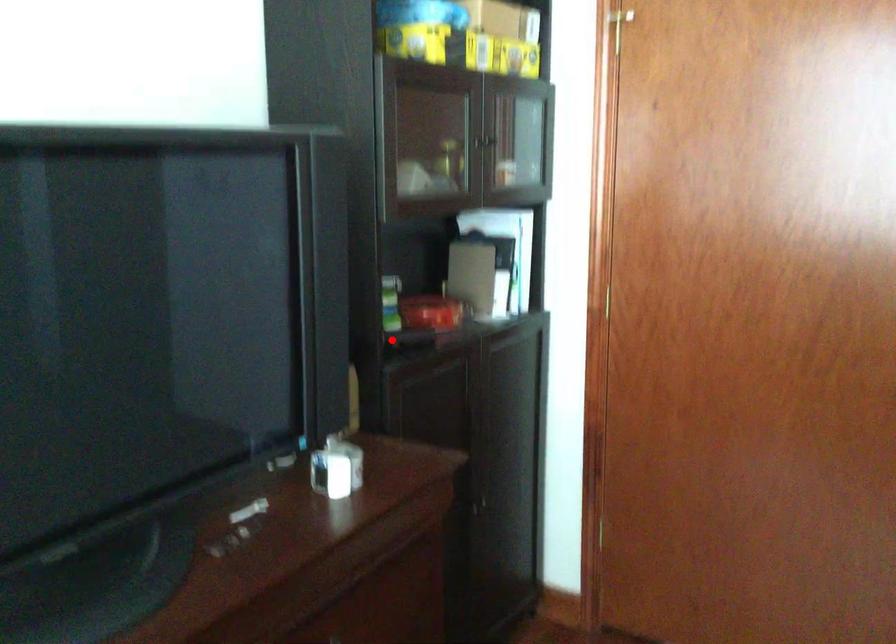
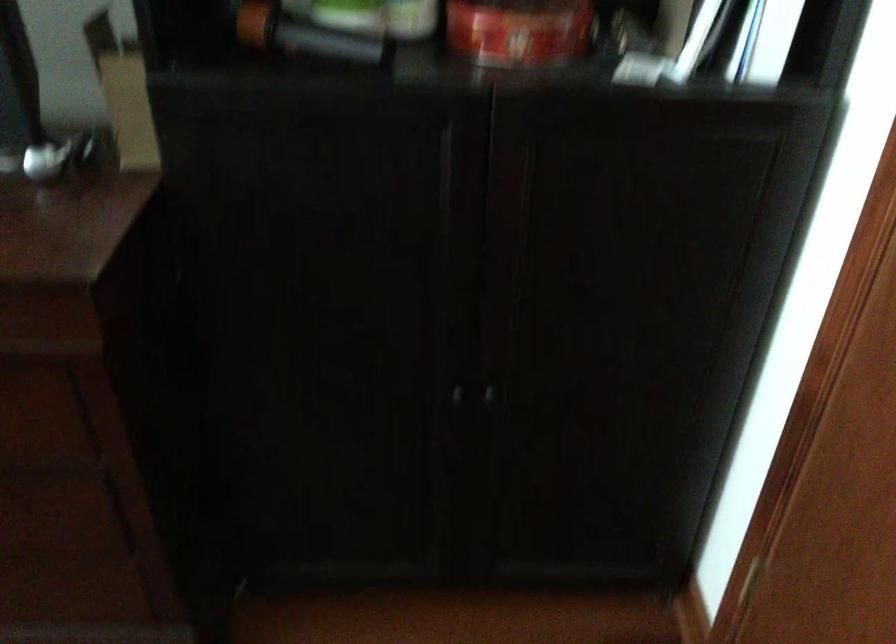
Where in the second image is the point corresponding to the highlighted location from the first image?

(304, 35)